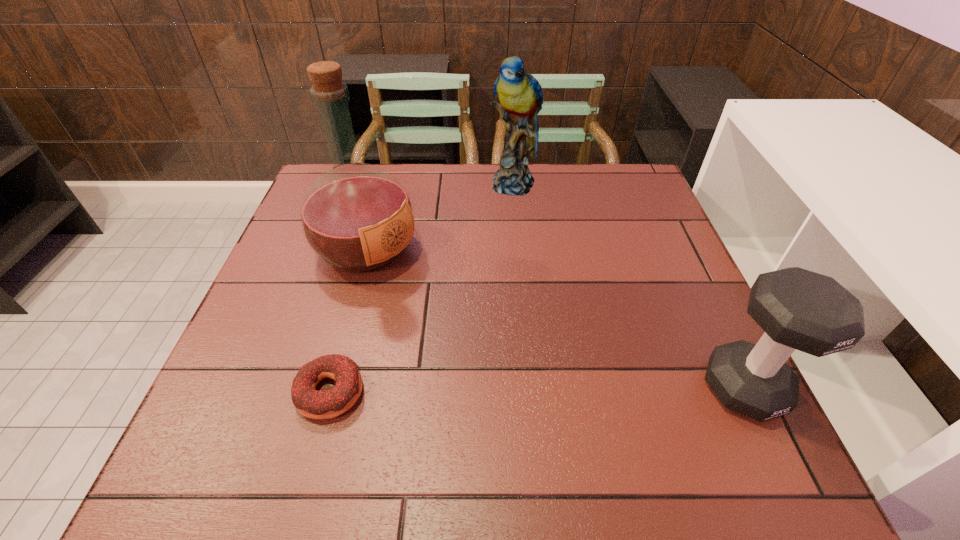
I want to click on blank region between the dumbbell and the second tallest object, so click(x=629, y=286).

Identify the location of free spot between the doughnut and the rightmost object. (537, 390).

Where is `unoccupied position between the parrot and the liquor`? This screenshot has height=540, width=960. unoccupied position between the parrot and the liquor is located at coordinates (441, 217).

Identify the location of unoccupied area between the second farthest object and the doughnut. (348, 321).

The image size is (960, 540). Find the location of `free space that is in between the second object from right to left and the liquor`. free space that is in between the second object from right to left and the liquor is located at coordinates (441, 217).

You are a GUI agent. You are given a task and a screenshot of the screen. Output one action in this format:
    pyautogui.click(x=<x>, y=<y>)
    Task: Click on the vacant point located between the third nearest object and the shortest object
    The height and width of the screenshot is (540, 960).
    Given the screenshot: What is the action you would take?
    pyautogui.click(x=348, y=321)

Point out which object is positioned as the third nearest to the second shortest object. Please provide its 2D coordinates. Your answer should be formatted as a tuple, i.e. [(x, y)], where the tuple contains the x and y coordinates of a point satisfying the conditions above.

[(311, 403)]

Point out which object is positioned as the third nearest to the third nearest object. Please provide its 2D coordinates. Your answer should be formatted as a tuple, i.e. [(x, y)], where the tuple contains the x and y coordinates of a point satisfying the conditions above.

[(798, 309)]

The height and width of the screenshot is (540, 960). In order to click on free space that satisfies the following two spatial constraints: 1. on the front side of the doughnut; 2. on the left side of the liquor in this screenshot , I will do `click(327, 392)`.

The image size is (960, 540). I want to click on vacant space that satisfies the following two spatial constraints: 1. on the front side of the second shortest object; 2. on the left side of the parrot, so click(x=534, y=388).